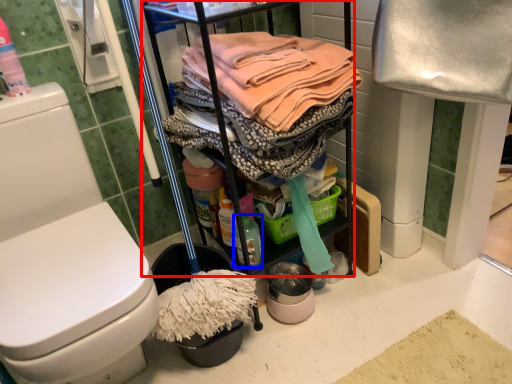
Question: Which of the following is the closest to the observer, cabinetry (highlighted by a red box) or cleaning products (highlighted by a blue box)?

Choices:
 (A) cabinetry
 (B) cleaning products

Answer: (A)